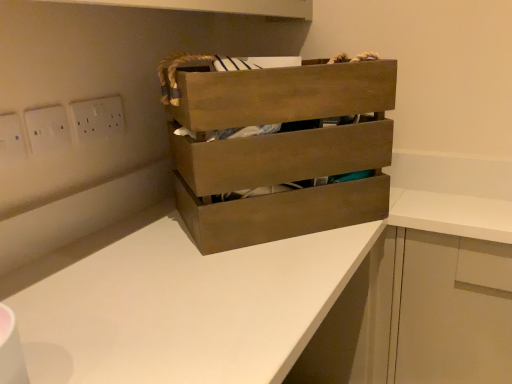
Question: Is point (93, 117) positioned closer to the camera than point (423, 319)?

Choices:
 (A) farther
 (B) closer

Answer: (B)

Question: Is white plastic electric outlet at upper left, acting as the first electric outlet starting from the back, wider or thinner than white matte cabinet at lower right?

Choices:
 (A) wide
 (B) thin

Answer: (B)

Question: Estimate the real-world distances between objects in this image. Which object is farther from the white matte cabinet at lower right?

Choices:
 (A) white matte counter at center
 (B) white plastic electric outlet at upper left, acting as the first electric outlet starting from the back
 (C) wooden crate at center
 (D) white plastic electric outlet at upper left, which is the third electric outlet in back-to-front order
 (E) white plastic switch at upper left, positioned as the 2th electric outlet in back-to-front order

Answer: (D)

Question: Based on their relative distances, which object is farther from the white plastic electric outlet at upper left, marked as the third electric outlet in a right-to-left arrangement?

Choices:
 (A) white matte counter at center
 (B) white plastic electric outlet at upper left, which ranks as the third electric outlet in front-to-back order
 (C) white plastic switch at upper left, positioned as the 2th electric outlet in back-to-front order
 (D) wooden crate at center
 (E) white matte cabinet at lower right

Answer: (E)